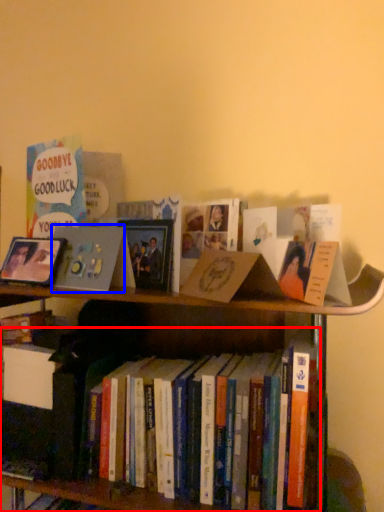
Question: Which object is closer to the camera taking this photo, book (highlighted by a red box) or book cover (highlighted by a blue box)?

Choices:
 (A) book
 (B) book cover

Answer: (A)